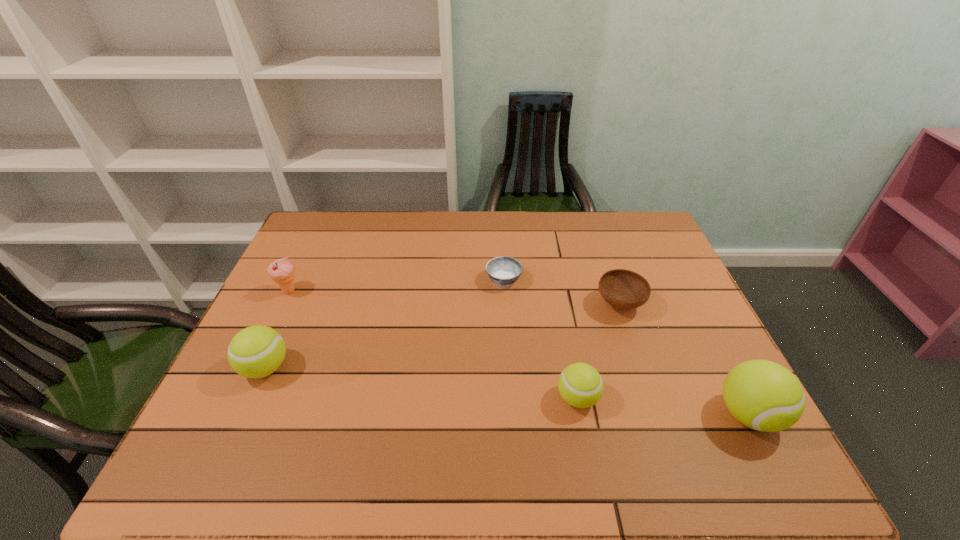
If equal spacing is the goal by inserting an additional tennis_ball among them, please point out a vacant space for this new tennis_ball. Please provide its 2D coordinates. Your answer should be formatted as a tuple, i.e. [(x, y)], where the tuple contains the x and y coordinates of a point satisfying the conditions above.

[(417, 383)]